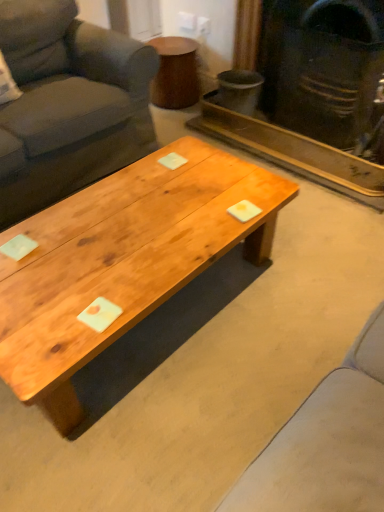
What do you see at coordinates (122, 261) in the screenshot? Image resolution: width=384 pixels, height=512 pixels. I see `natural wood coffee table at center` at bounding box center [122, 261].

Describe the element at coordinates (175, 73) in the screenshot. I see `wooden side table at upper center` at that location.

The width and height of the screenshot is (384, 512). In order to click on natural wood coffee table at center in this screenshot , I will do pyautogui.click(x=122, y=261).

The image size is (384, 512). Identify the location of studio couch that is on the left side of matte black fireplace at upper right. (68, 104).

Who is smaller, matte black fireplace at upper right or dark gray fabric couch at left?

matte black fireplace at upper right is smaller.

Between matte black fireplace at upper right and dark gray fabric couch at left, which one has smaller width?

matte black fireplace at upper right.

In the scene shown: Is matte black fireplace at upper right to the left of dark gray fabric couch at left from the viewer's perspective?

No, matte black fireplace at upper right is not to the left of dark gray fabric couch at left.

Find the location of a particular element. coffee table below the wooden side table at upper center (from the image's perspective) is located at coordinates (122, 261).

Is wooden side table at upper center not close to natural wood coffee table at center?

Absolutely, wooden side table at upper center is distant from natural wood coffee table at center.

Is wooden side table at upper center bigger or smaller than natural wood coffee table at center?

Clearly, wooden side table at upper center is smaller in size than natural wood coffee table at center.

Considering the sizes of objects wooden side table at upper center and natural wood coffee table at center in the image provided, who is taller, wooden side table at upper center or natural wood coffee table at center?

Standing taller between the two is natural wood coffee table at center.

At what (x,y) coordinates should I click in order to perform the action: click on side table below the natural wood coffee table at center (from a real-world perspective). Please return your answer as a coordinate pair (x, y). Looking at the image, I should click on (175, 73).

Is natural wood coffee table at center to the left of wooden side table at upper center from the viewer's perspective?

Correct, you'll find natural wood coffee table at center to the left of wooden side table at upper center.

Can you confirm if matte black fireplace at upper right is taller than natural wood coffee table at center?

Correct, matte black fireplace at upper right is much taller as natural wood coffee table at center.

From the image's perspective, would you say matte black fireplace at upper right is shown under natural wood coffee table at center?

No, from the image's perspective, matte black fireplace at upper right is not below natural wood coffee table at center.

Who is bigger, matte black fireplace at upper right or natural wood coffee table at center?

Bigger between the two is natural wood coffee table at center.

Is matte black fireplace at upper right wider or thinner than natural wood coffee table at center?

Clearly, matte black fireplace at upper right has less width compared to natural wood coffee table at center.

Is wooden side table at upper center positioned with its back to matte black fireplace at upper right?

That's not correct — wooden side table at upper center is not looking away from matte black fireplace at upper right.

Is point (170, 89) closer or farther from the camera than point (292, 123)?

Point (170, 89) appears to be farther away from the viewer than point (292, 123).

Does wooden side table at upper center come behind matte black fireplace at upper right?

Yes, wooden side table at upper center is further from the camera.

Can you confirm if wooden side table at upper center is smaller than matte black fireplace at upper right?

Yes.

How many degrees apart are the facing directions of dark gray fabric couch at left and matte black fireplace at upper right?

The angle between the facing direction of dark gray fabric couch at left and the facing direction of matte black fireplace at upper right is 90 degrees.

Which object is thinner, dark gray fabric couch at left or matte black fireplace at upper right?

matte black fireplace at upper right is thinner.

Does dark gray fabric couch at left appear on the right side of matte black fireplace at upper right?

No, dark gray fabric couch at left is not to the right of matte black fireplace at upper right.

In the scene shown: Measure the distance from dark gray fabric couch at left to matte black fireplace at upper right.

dark gray fabric couch at left is 36.67 inches from matte black fireplace at upper right.

From the image's perspective, does dark gray fabric couch at left appear higher than natural wood coffee table at center?

Yes.

The image size is (384, 512). Find the location of `coffee table below the dark gray fabric couch at left (from a real-world perspective)`. coffee table below the dark gray fabric couch at left (from a real-world perspective) is located at coordinates (122, 261).

Based on their sizes in the image, would you say dark gray fabric couch at left is bigger or smaller than natural wood coffee table at center?

Considering their sizes, dark gray fabric couch at left takes up more space than natural wood coffee table at center.

Is dark gray fabric couch at left aimed at natural wood coffee table at center?

Yes, dark gray fabric couch at left faces towards natural wood coffee table at center.

Image resolution: width=384 pixels, height=512 pixels. In order to click on fireplace to the right of dark gray fabric couch at left in this screenshot , I will do `click(317, 95)`.

You are a GUI agent. You are given a task and a screenshot of the screen. Output one action in this format:
    pyautogui.click(x=<x>, y=<y>)
    Task: Click on the coffee table above the wooden side table at upper center (from a real-world perspective)
    This screenshot has width=384, height=512.
    Given the screenshot: What is the action you would take?
    pyautogui.click(x=122, y=261)

Looking at the image, which one is located further to wooden side table at upper center, dark gray fabric couch at left or natural wood coffee table at center?

The object further to wooden side table at upper center is natural wood coffee table at center.

Estimate the real-world distances between objects in this image. Which object is closer to wooden side table at upper center, natural wood coffee table at center or dark gray fabric couch at left?

dark gray fabric couch at left lies closer to wooden side table at upper center than the other object.

Considering their positions, is natural wood coffee table at center positioned further to dark gray fabric couch at left than wooden side table at upper center?

Among the two, wooden side table at upper center is located further to dark gray fabric couch at left.

From the image, which object appears to be farther from dark gray fabric couch at left, matte black fireplace at upper right or natural wood coffee table at center?

matte black fireplace at upper right is further to dark gray fabric couch at left.

Which object lies further to the anchor point wooden side table at upper center, matte black fireplace at upper right or dark gray fabric couch at left?

dark gray fabric couch at left is further to wooden side table at upper center.

Which object lies nearer to the anchor point natural wood coffee table at center, wooden side table at upper center or dark gray fabric couch at left?

dark gray fabric couch at left.

Which object lies nearer to the anchor point natural wood coffee table at center, matte black fireplace at upper right or dark gray fabric couch at left?

Based on the image, dark gray fabric couch at left appears to be nearer to natural wood coffee table at center.

Looking at this image, based on their spatial positions, is wooden side table at upper center or dark gray fabric couch at left closer to matte black fireplace at upper right?

Based on the image, wooden side table at upper center appears to be nearer to matte black fireplace at upper right.

Image resolution: width=384 pixels, height=512 pixels. Find the location of `side table situated between dark gray fabric couch at left and matte black fireplace at upper right from left to right`. side table situated between dark gray fabric couch at left and matte black fireplace at upper right from left to right is located at coordinates (175, 73).

Locate an element on the screen. The image size is (384, 512). fireplace located between natural wood coffee table at center and wooden side table at upper center in the depth direction is located at coordinates (317, 95).

Where is `studio couch located between natural wood coffee table at center and wooden side table at upper center in the depth direction`? studio couch located between natural wood coffee table at center and wooden side table at upper center in the depth direction is located at coordinates (68, 104).

This screenshot has width=384, height=512. Find the location of `coffee table between dark gray fabric couch at left and matte black fireplace at upper right from left to right`. coffee table between dark gray fabric couch at left and matte black fireplace at upper right from left to right is located at coordinates (122, 261).